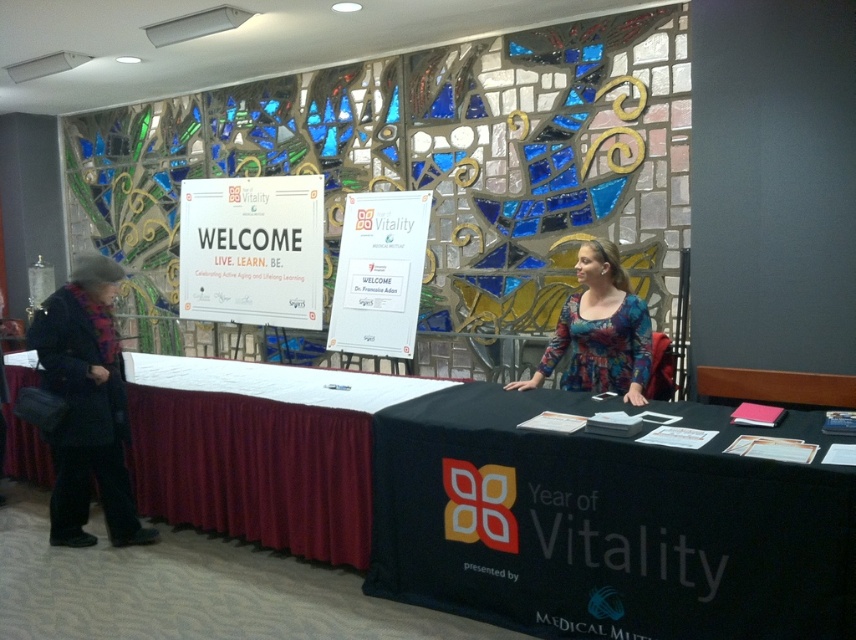
You are attending an event and want to approach the table to pick up materials. As you walk towards the table, you notice the white paper sign at center and the multicolored fabric blouse at center. Which object will you see first as you approach the table straight on?

The white paper sign at center is to the left of the multicolored fabric blouse at center, so as you approach the table straight on, you will see the multicolored fabric blouse at center first because it is positioned more to the center, and the sign is slightly to its left.

You are attending an event and need to reach the white cloth at lower left to grab a brochure. The multicolored fabric blouse at center is blocking your path. Can you walk around the blouse to reach the cloth?

The multicolored fabric blouse at center is behind the white cloth at lower left, so you can walk around the blouse to reach the cloth.